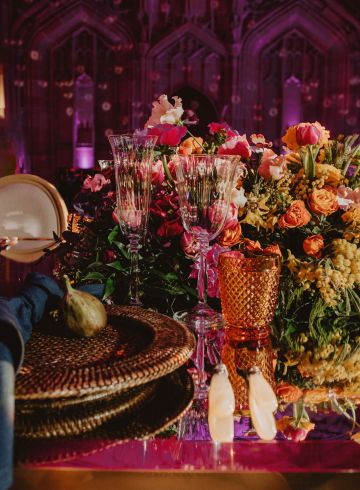
The image size is (360, 490). I want to click on mirrored tabletop, so click(320, 416).